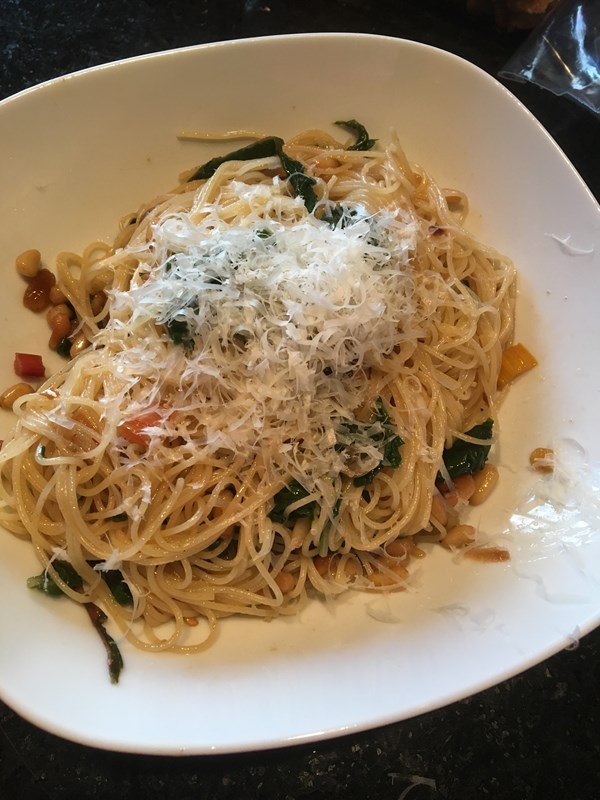
Locate an element on the screen. The width and height of the screenshot is (600, 800). tabletop is located at coordinates (468, 778), (295, 18).